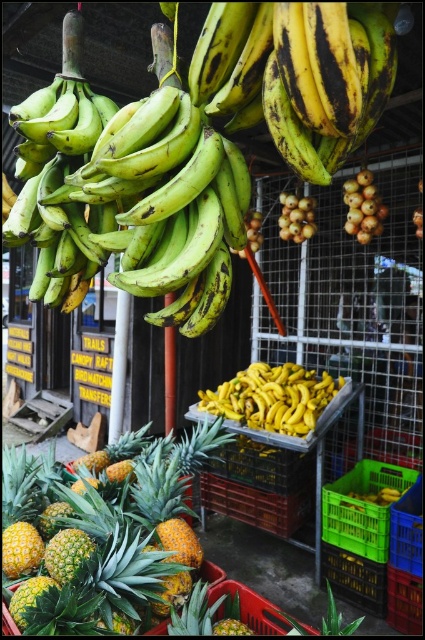
Question: Can you confirm if ripe yellow bananas at center is bigger than smooth brown plums at center?

Choices:
 (A) yes
 (B) no

Answer: (A)

Question: Estimate the real-world distances between objects in this image. Which object is farther from the ripe yellow bananas at center?

Choices:
 (A) smooth brown plums at center
 (B) green matte bananas at upper left
 (C) yellow matte bananas at center

Answer: (A)

Question: Among these objects, which one is nearest to the camera?

Choices:
 (A) yellow matte bananas at center
 (B) yellow spiky pineapple at center

Answer: (B)

Question: Is green matte bananas at upper left behind smooth brown plums at center?

Choices:
 (A) no
 (B) yes

Answer: (A)

Question: Does yellow spiky pineapple at center appear on the left side of smooth brown onion at center right?

Choices:
 (A) no
 (B) yes

Answer: (B)

Question: Estimate the real-world distances between objects in this image. Which object is farther from the smooth brown onion at center right?

Choices:
 (A) yellow matte bananas at center
 (B) smooth brown plums at center
 (C) ripe yellow bananas at center

Answer: (C)